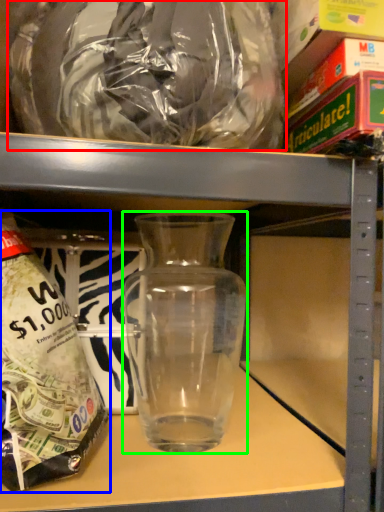
Question: Based on their relative distances, which object is farther from plastic bag (highlighted by a red box)? Choose from bottle (highlighted by a blue box) and vase (highlighted by a green box).

Choices:
 (A) bottle
 (B) vase

Answer: (B)